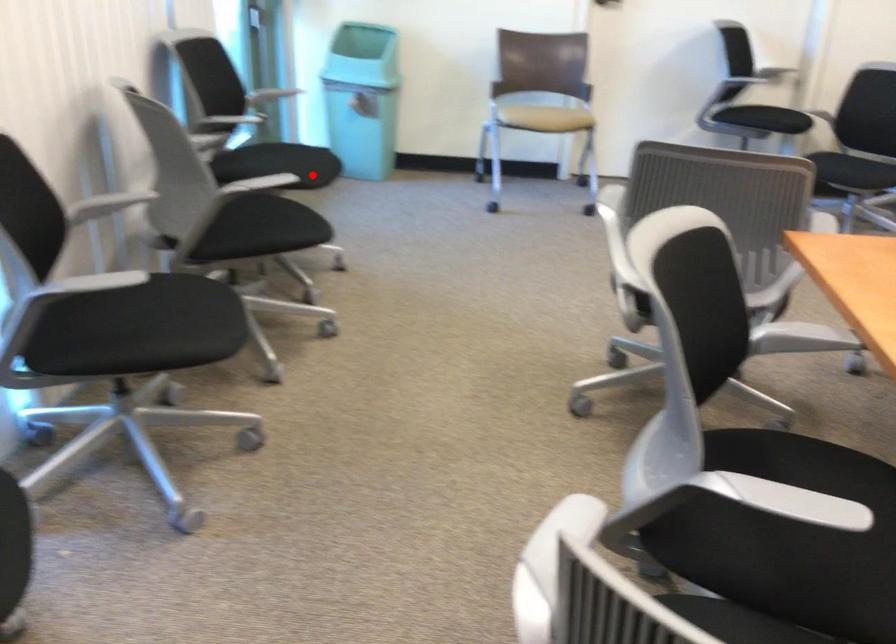
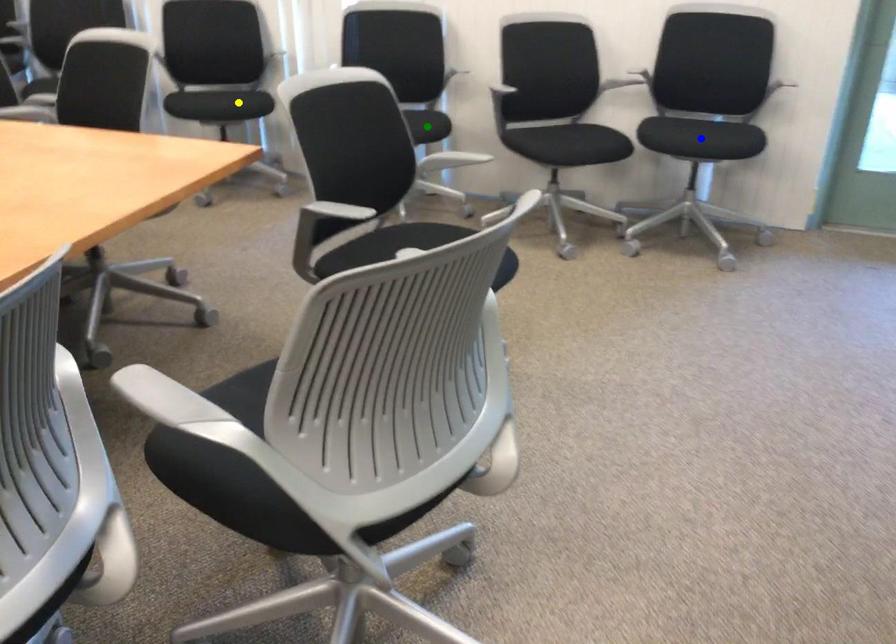
Question: I am providing you with two images of the same scene from different viewpoints. A red point is marked on the first image. You are given multiple points on the second image. Which point in image 2 represents the same 3d spot as the red point in image 1?

Choices:
 (A) blue point
 (B) yellow point
 (C) green point

Answer: (A)